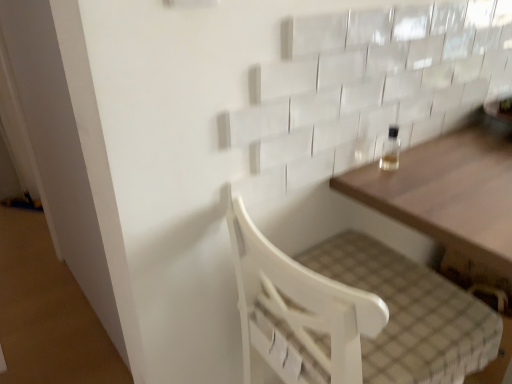
Where is `free space in front of clear glass bottle at upper right`? The image size is (512, 384). free space in front of clear glass bottle at upper right is located at coordinates (395, 190).